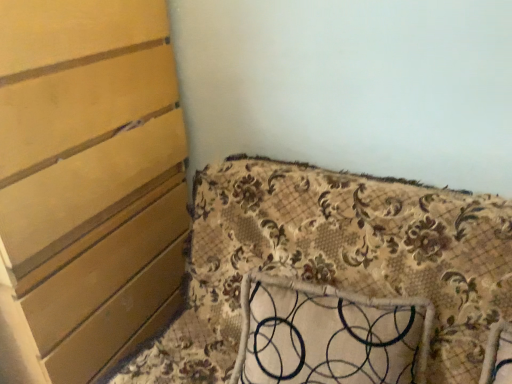
Question: Looking at their shapes, would you say floral fabric pillow at center is wider or thinner than matte wood chest of drawers at left?

Choices:
 (A) thin
 (B) wide

Answer: (A)

Question: Does point (354, 329) appear closer or farther from the camera than point (155, 304)?

Choices:
 (A) farther
 (B) closer

Answer: (B)

Question: Estimate the real-world distances between objects in this image. Which object is closer to the floral fabric cushion at lower right?

Choices:
 (A) matte wood chest of drawers at left
 (B) floral fabric pillow at center

Answer: (B)

Question: Estimate the real-world distances between objects in this image. Which object is farther from the floral fabric cushion at lower right?

Choices:
 (A) matte wood chest of drawers at left
 (B) floral fabric pillow at center

Answer: (A)